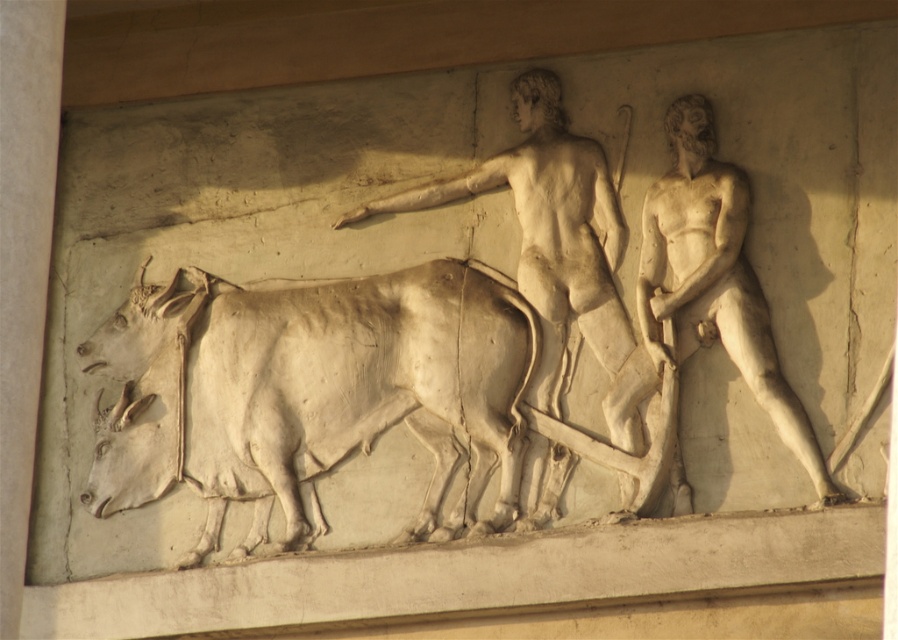
Who is taller, white marble man at center or white marble man at right?

Standing taller between the two is white marble man at center.

Who is more forward, (582, 314) or (667, 173)?

Positioned in front is point (582, 314).

Is point (555, 388) positioned in front of point (656, 285)?

Yes, it is in front of point (656, 285).

This screenshot has height=640, width=898. I want to click on white marble man at center, so click(556, 278).

Can you confirm if white stone cow at center is positioned above white marble man at right?

No, white stone cow at center is not above white marble man at right.

Is white stone cow at center taller than white marble man at right?

Incorrect, white stone cow at center's height is not larger of white marble man at right's.

Locate an element on the screen. white stone cow at center is located at coordinates (310, 392).

Who is more forward, (348, 362) or (522, 264)?

Point (348, 362) is more forward.

Can you confirm if white stone cow at center is positioned above white marble man at center?

Incorrect, white stone cow at center is not positioned above white marble man at center.

Is point (433, 280) positioned after point (524, 141)?

No, (433, 280) is in front of (524, 141).

This screenshot has width=898, height=640. I want to click on white stone cow at center, so click(310, 392).